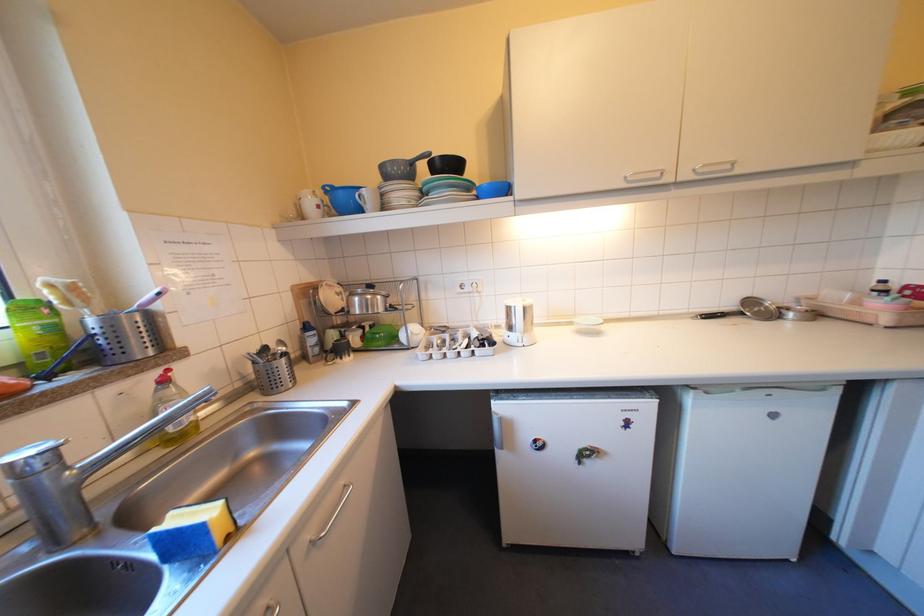
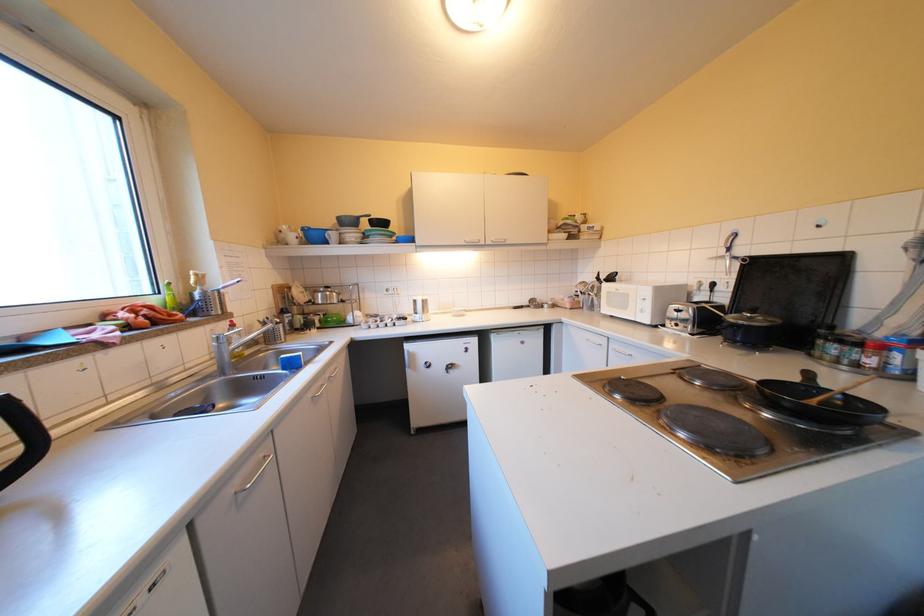
Question: Which direction would the cameraman need to move to produce the second image? Reply with the corresponding letter.

Choices:
 (A) Left
 (B) Right
 (C) Forward
 (D) Backward

Answer: (D)